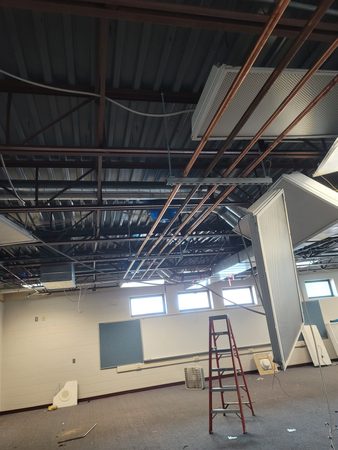
I want to click on electric lead, so click(x=115, y=103).